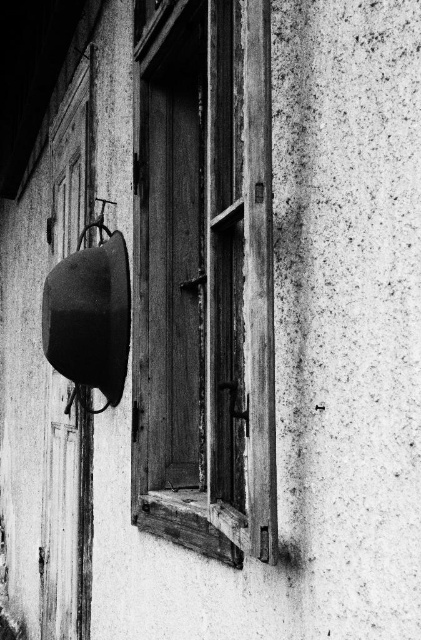
You are an architect assessing the structural integrity of the building. You notice the wooden at left and the metallic smooth pot at left. Which object is taller?

The wooden at left is taller than the metallic smooth pot at left according to the description.

You are standing in front of the aged building shown in the image. There is a point at coordinates point (x=162, y=273). Can you reach this point with your hand if you are 8.36 feet away from it?

The point (x=162, y=273) is 8.36 feet away from the viewer. Since the average human arm length is about 2.5 feet, you cannot reach the point with your hand from that distance.

You are a painter standing 3 feet away from the wooden window at center and the metallic smooth pot at left. You need to paint both items. Which object should you paint first if you want to start with the one closer to you?

The wooden window at center is closer to you since it is only 21.69 inches from the metallic smooth pot at left, which is farther away.